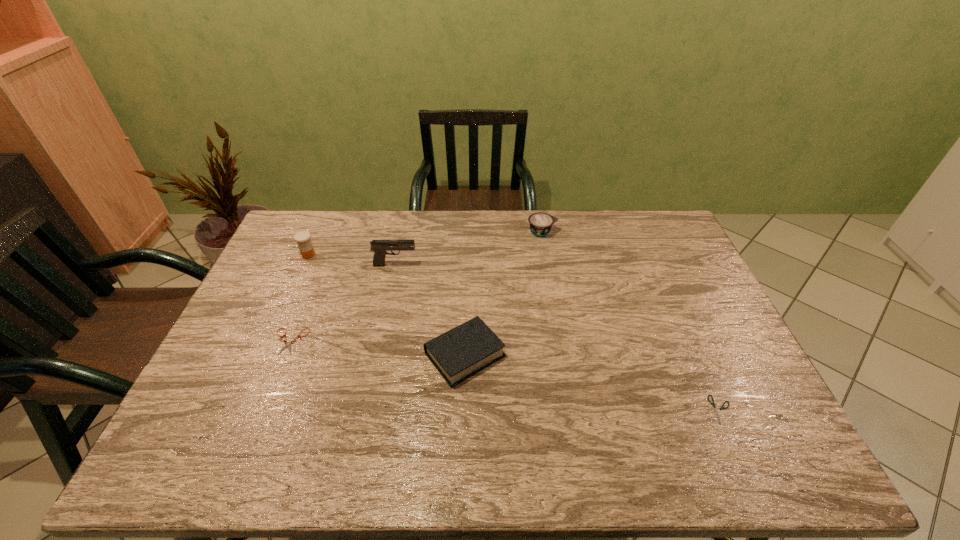
The height and width of the screenshot is (540, 960). I want to click on free spot that satisfies the following two spatial constraints: 1. aim along the barrel of the fourth object from right to left; 2. on the right side of the Bible, so click(376, 355).

At what (x,y) coordinates should I click in order to perform the action: click on blank area in the image that satisfies the following two spatial constraints: 1. aim along the barrel of the fourth object from left to right; 2. on the left side of the third farthest object. Please return your answer as a coordinate pair (x, y). The width and height of the screenshot is (960, 540). Looking at the image, I should click on (376, 355).

Locate an element on the screen. This screenshot has width=960, height=540. vacant area that satisfies the following two spatial constraints: 1. on the back side of the farthest object; 2. on the right side of the third object from right to left is located at coordinates (468, 232).

Identify the location of free spot that satisfies the following two spatial constraints: 1. on the label of the second tallest object; 2. on the right side of the fifth tallest object. (271, 341).

Identify the location of blank space that satisfies the following two spatial constraints: 1. aim along the barrel of the right shears; 2. on the left side of the pistol. (365, 409).

Locate an element on the screen. free spot that satisfies the following two spatial constraints: 1. on the label of the second farthest object; 2. on the right side of the farther shears is located at coordinates (271, 341).

This screenshot has height=540, width=960. I want to click on free space that satisfies the following two spatial constraints: 1. on the back side of the farthest object; 2. on the left side of the left shears, so click(333, 232).